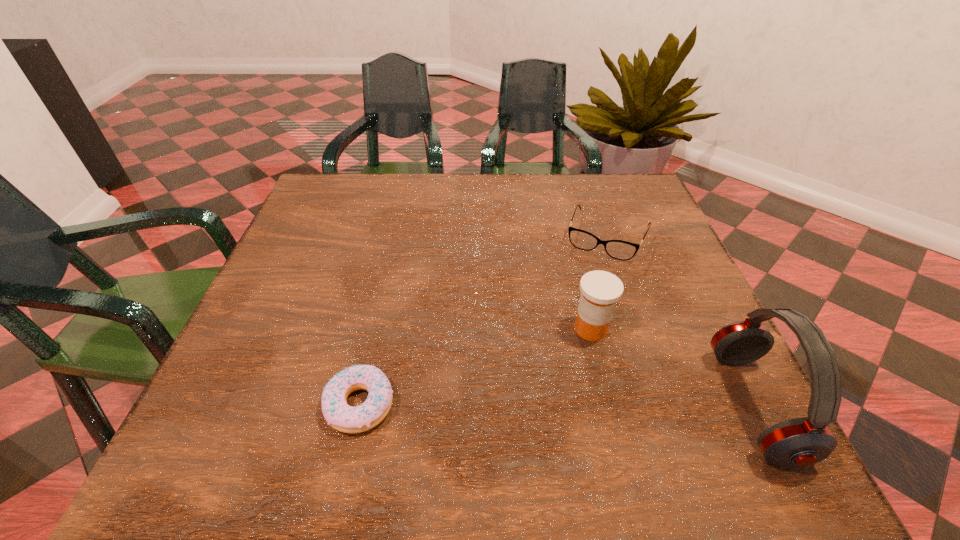
At what (x,y) coordinates should I click in order to perform the action: click on vacant area that lies between the second farthest object and the rightmost object. Please return your answer as a coordinate pair (x, y). The image size is (960, 540). Looking at the image, I should click on (672, 367).

Identify the location of free space between the spectacles and the leftmost object. (484, 321).

This screenshot has width=960, height=540. I want to click on free area in between the spectacles and the doughnut, so click(484, 321).

I want to click on empty space that is in between the second tallest object and the tallest object, so click(x=672, y=367).

I want to click on free point between the earphone and the leftmost object, so click(x=557, y=405).

In order to click on empty space that is in between the earphone and the farthest object in this screenshot , I will do click(680, 322).

Find the location of `blank region between the medicine and the doughnut`. blank region between the medicine and the doughnut is located at coordinates [x=475, y=367].

Locate which object ranks second in proximity to the earphone. Please provide its 2D coordinates. Your answer should be formatted as a tuple, i.e. [(x, y)], where the tuple contains the x and y coordinates of a point satisfying the conditions above.

[(618, 249)]

I want to click on the closest object to the tallest object, so click(x=600, y=290).

Find the location of a particular element. This screenshot has height=540, width=960. vacant position in the image that satisfies the following two spatial constraints: 1. on the front side of the earphone; 2. on the ear cups of the third shortest object is located at coordinates (610, 405).